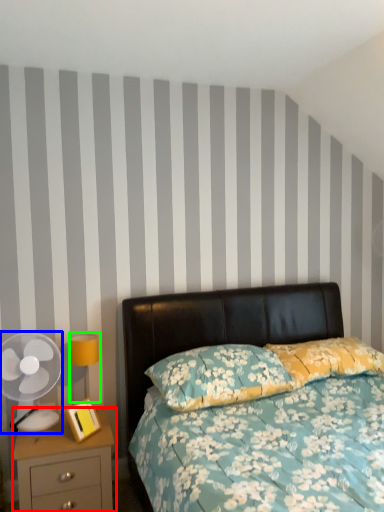
Question: Which object is the farthest from nightstand (highlighted by a red box)? Choose among these: mechanical fan (highlighted by a blue box) or bedside lamp (highlighted by a green box).

Choices:
 (A) mechanical fan
 (B) bedside lamp

Answer: (B)